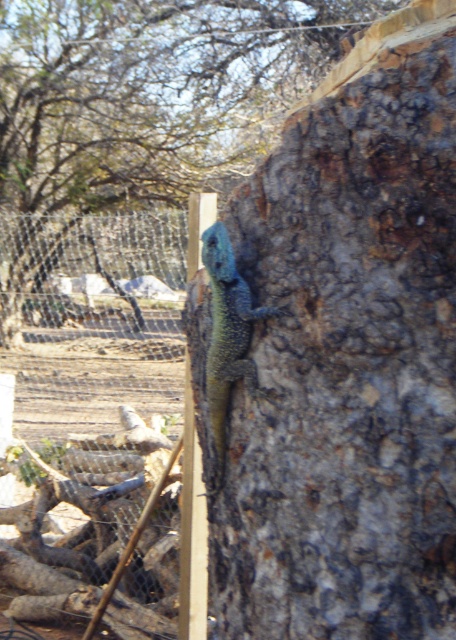
Question: Does wire mesh fence at left appear on the right side of blue-green scaly lizard at center?

Choices:
 (A) yes
 (B) no

Answer: (B)

Question: Does wire mesh fence at left appear on the right side of blue-green scaly lizard at center?

Choices:
 (A) no
 (B) yes

Answer: (A)

Question: Which object is positioned farthest from the smooth bark tree trunk at center?

Choices:
 (A) smooth bark tree at center
 (B) blue-green scaly lizard at center

Answer: (A)

Question: Does smooth bark tree at center appear under blue-green scaly lizard at center?

Choices:
 (A) no
 (B) yes

Answer: (A)

Question: Which object is farther from the camera taking this photo?

Choices:
 (A) smooth bark tree at center
 (B) smooth bark tree trunk at center
 (C) blue-green scaly lizard at center
 (D) wire mesh fence at left

Answer: (A)

Question: Which object is the farthest from the blue-green scaly lizard at center?

Choices:
 (A) smooth bark tree trunk at center
 (B) wire mesh fence at left

Answer: (B)